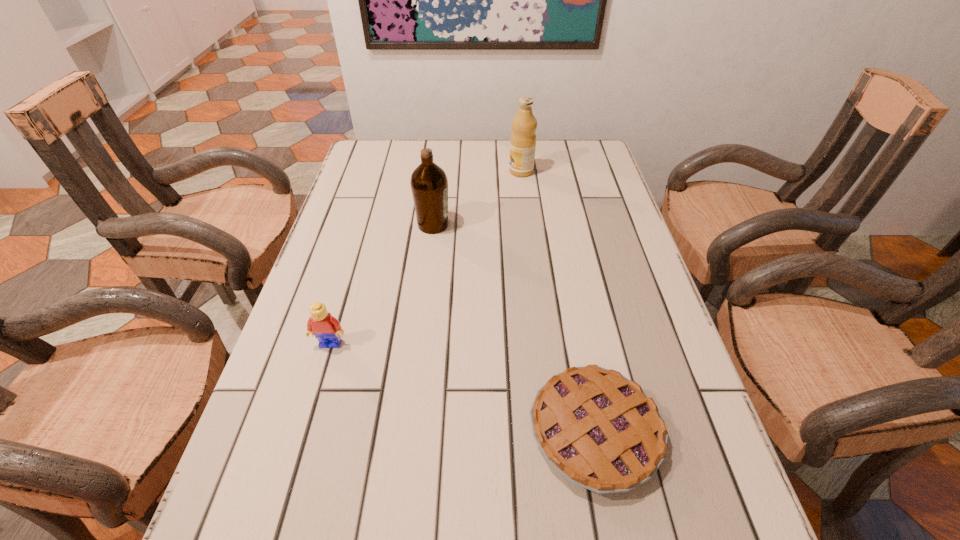
Identify the location of the farther olive oil. The image size is (960, 540). [523, 138].

This screenshot has height=540, width=960. I want to click on the farthest object, so click(x=523, y=138).

What are the coordinates of `the left olive oil` in the screenshot? It's located at (429, 184).

Identify the location of the nearer olive oil. pyautogui.click(x=429, y=184).

Where is `the leftmost object`? The height and width of the screenshot is (540, 960). the leftmost object is located at coordinates [326, 328].

The image size is (960, 540). In order to click on the second nearest object in this screenshot , I will do `click(326, 328)`.

Where is `the nearest object`? the nearest object is located at coordinates (601, 431).

The height and width of the screenshot is (540, 960). Identify the location of pie. (601, 431).

Identify the location of vacant region located on the label of the farther olive oil. pyautogui.click(x=414, y=171).

I want to click on free space located on the label of the farther olive oil, so click(x=439, y=171).